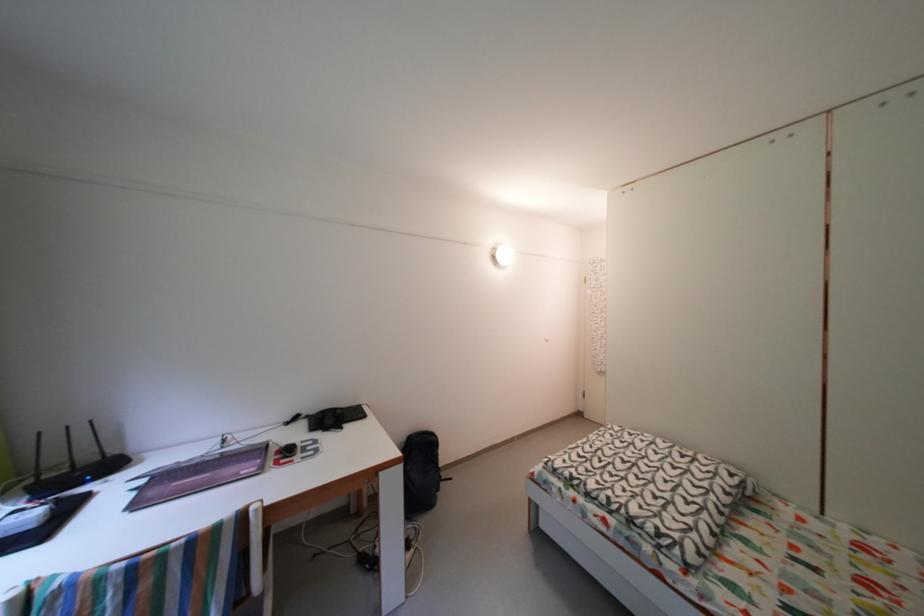
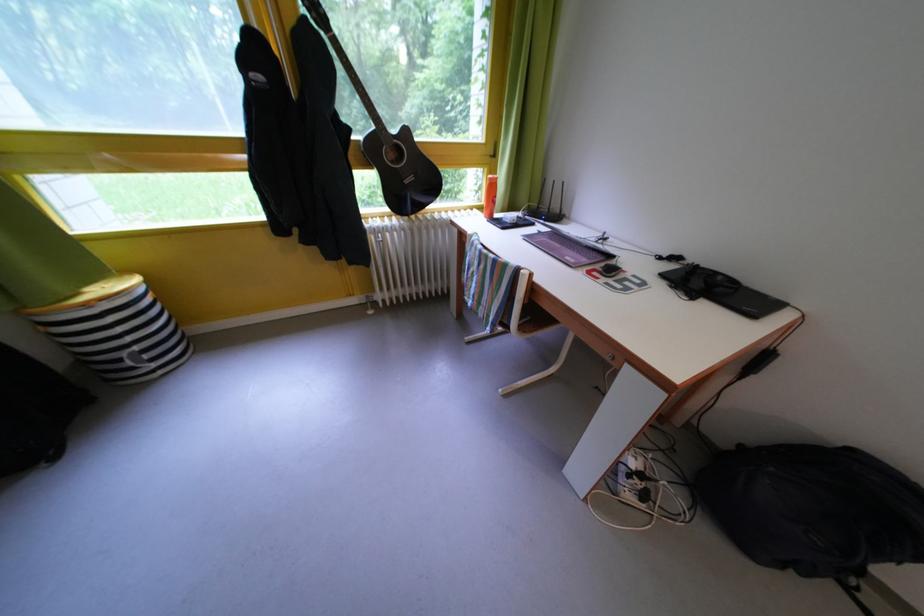
The images are taken continuously from a first-person perspective. In which direction is your viewpoint rotating?

The rotation direction of the camera is left-down.